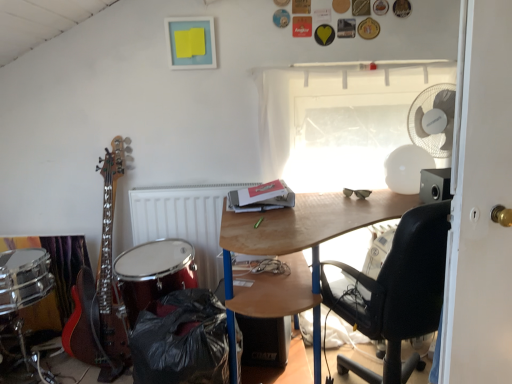
Question: From their relative heights in the image, would you say transparent plastic window at upper center is taller or shorter than white plastic mechanical fan at upper right?

Choices:
 (A) short
 (B) tall

Answer: (B)

Question: Is transparent plastic window at upper center wider or thinner than white plastic mechanical fan at upper right?

Choices:
 (A) wide
 (B) thin

Answer: (B)

Question: Which object is the farthest from the white plastic mechanical fan at upper right?

Choices:
 (A) white matte radiator at center
 (B) shiny red drum at lower left
 (C) black plastic trash can at lower left
 (D) hardcover book at center
 (E) wooden desk at center

Answer: (B)

Question: Based on their relative distances, which object is farther from the hardcover book at center?

Choices:
 (A) wooden desk at center
 (B) white matte radiator at center
 (C) transparent plastic window at upper center
 (D) black matte speaker at lower center
 (E) white plastic mechanical fan at upper right

Answer: (D)